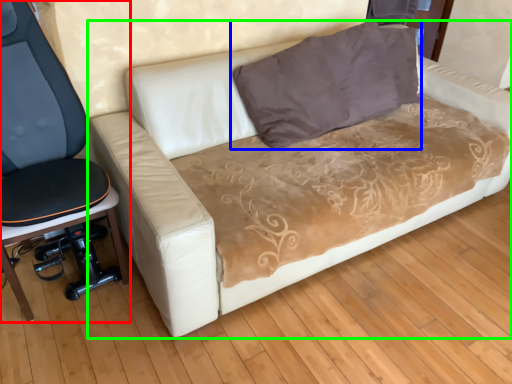
Question: Based on their relative distances, which object is farther from furniture (highlighted by a red box)? Choose from pillow (highlighted by a blue box) and studio couch (highlighted by a green box).

Choices:
 (A) pillow
 (B) studio couch

Answer: (A)